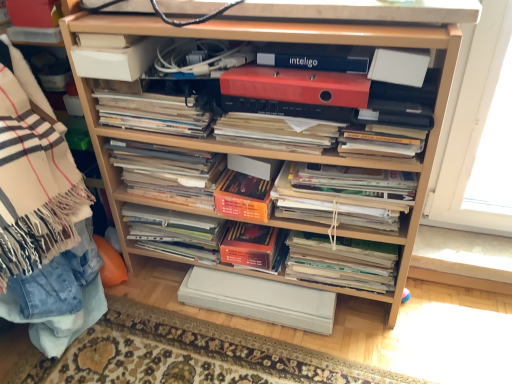
At what (x,y) coordinates should I click in order to perform the action: click on free space above matte paper magazine at lower center, the 7th magazine from the top (from a real-world perspective). Please return your answer as a coordinate pair (x, y). The width and height of the screenshot is (512, 384). Looking at the image, I should click on (344, 244).